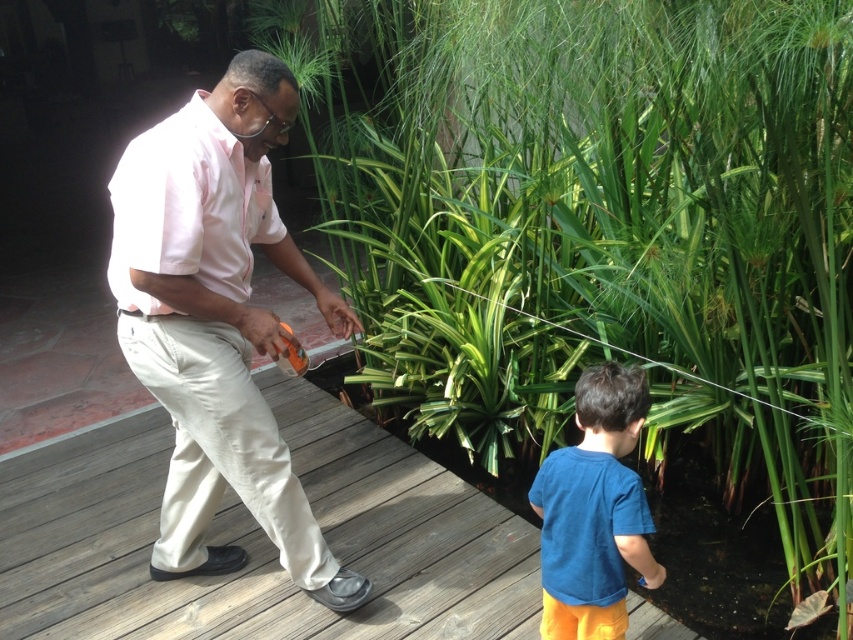
Question: Is wooden deck at center to the left of blue cotton shirt at lower right from the viewer's perspective?

Choices:
 (A) yes
 (B) no

Answer: (A)

Question: Is wooden deck at center to the right of pink cotton shirt at left from the viewer's perspective?

Choices:
 (A) yes
 (B) no

Answer: (B)

Question: Which point is closer to the camera taking this photo?

Choices:
 (A) (265, 128)
 (B) (367, 554)
 (C) (575, 624)

Answer: (A)

Question: Among these points, which one is farthest from the camera?

Choices:
 (A) (576, 548)
 (B) (138, 134)
 (C) (181, 600)
 (D) (633, 36)

Answer: (C)

Question: Among these objects, which one is nearest to the camera?

Choices:
 (A) pink cotton shirt at left
 (B) green leafy plant at center
 (C) blue cotton shirt at lower right
 (D) wooden deck at center

Answer: (B)

Question: Does green leafy plant at center appear under wooden deck at center?

Choices:
 (A) yes
 (B) no

Answer: (B)